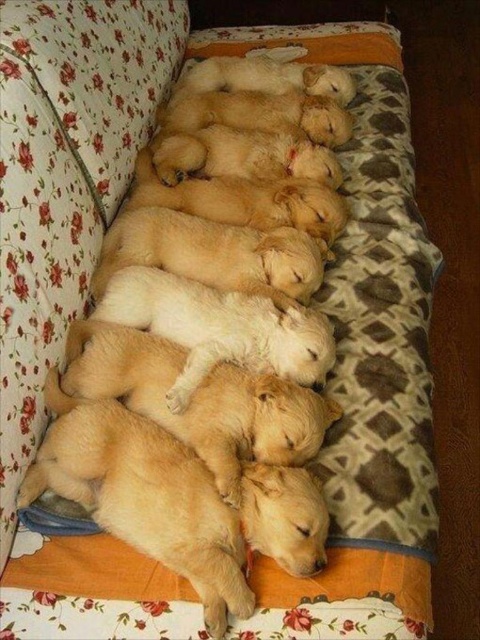
Question: Among these objects, which one is farthest from the camera?

Choices:
 (A) soft golden fur puppies at center
 (B) soft fleece pillow at center

Answer: (B)

Question: Can you confirm if soft fleece pillow at center is positioned to the left of soft golden fur puppies at center?

Choices:
 (A) yes
 (B) no

Answer: (B)

Question: Which of the following is the closest to the observer?

Choices:
 (A) soft fleece pillow at center
 (B) soft golden fur puppies at center

Answer: (B)

Question: Is soft fleece pillow at center thinner than soft golden fur puppies at center?

Choices:
 (A) yes
 (B) no

Answer: (B)

Question: Among these points, which one is nearest to the camera?

Choices:
 (A) (296, 518)
 (B) (356, 188)

Answer: (A)

Question: Can you confirm if soft fleece pillow at center is positioned below soft golden fur puppies at center?

Choices:
 (A) yes
 (B) no

Answer: (B)